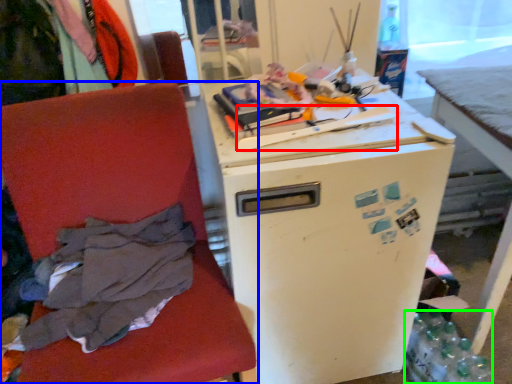
Question: Which object is the farthest from equipment (highlighted by a red box)? Choose among these: chair (highlighted by a blue box) or bottle (highlighted by a green box).

Choices:
 (A) chair
 (B) bottle

Answer: (B)